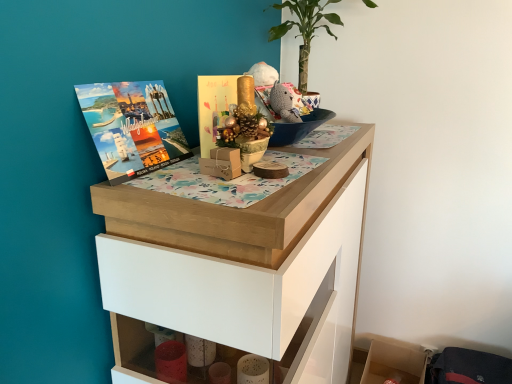
What is the approximate height of wooden shelf at lower right?

It is 10.06 inches.

The image size is (512, 384). Describe the element at coordinates (305, 29) in the screenshot. I see `green leafy plant at upper center` at that location.

What do you see at coordinates (132, 127) in the screenshot? The width and height of the screenshot is (512, 384). I see `matte paper book cover at upper left, which appears as the 1th book cover when viewed from the left` at bounding box center [132, 127].

Locate an element on the screen. This screenshot has width=512, height=384. wooden shelf at lower right is located at coordinates (394, 364).

Would you consider wooden shelf at lower right to be distant from green leafy plant at upper center?

Yes, wooden shelf at lower right is far from green leafy plant at upper center.

Consider the image. Does wooden shelf at lower right have a larger size compared to green leafy plant at upper center?

No, wooden shelf at lower right is not bigger than green leafy plant at upper center.

Between wooden shelf at lower right and green leafy plant at upper center, which one has smaller width?

Thinner between the two is wooden shelf at lower right.

Is point (121, 130) closer to viewer compared to point (211, 134)?

Yes, point (121, 130) is closer to viewer.

Measure the distance from matte paper book cover at upper left, the 2th book cover in the right-to-left sequence, to gold paper card at center, which is counted as the second book cover, starting from the left.

They are 6.07 inches apart.

Between matte paper book cover at upper left, the 2th book cover in the right-to-left sequence, and gold paper card at center, which is counted as the second book cover, starting from the left, which one is positioned behind?

gold paper card at center, which is counted as the second book cover, starting from the left, is further from the camera.

From a real-world perspective, which object rests below the other?

matte paper book cover at upper left, which appears as the 1th book cover when viewed from the left, is physically lower.

Is wooden shelf at lower right looking in the opposite direction of wooden chest of drawers at upper center?

wooden shelf at lower right does not have its back to wooden chest of drawers at upper center.

Consider the image. Between wooden shelf at lower right and wooden chest of drawers at upper center, which one has smaller size?

Smaller between the two is wooden shelf at lower right.

Is point (393, 364) closer to viewer compared to point (349, 159)?

No, it is behind (349, 159).

Is wooden shelf at lower right in front of or behind wooden chest of drawers at upper center in the image?

Visually, wooden shelf at lower right is located behind wooden chest of drawers at upper center.

From a real-world perspective, is wooden chest of drawers at upper center positioned above or below matte paper book cover at upper left, the 2th book cover in the right-to-left sequence?

wooden chest of drawers at upper center is below matte paper book cover at upper left, the 2th book cover in the right-to-left sequence.

Is wooden chest of drawers at upper center oriented away from matte paper book cover at upper left, which appears as the 1th book cover when viewed from the left?

No.

In the image, is wooden chest of drawers at upper center positioned in front of or behind matte paper book cover at upper left, which appears as the 1th book cover when viewed from the left?

In the image, wooden chest of drawers at upper center appears in front of matte paper book cover at upper left, which appears as the 1th book cover when viewed from the left.

Consider the image. Which of these two, wooden chest of drawers at upper center or matte paper book cover at upper left, the 2th book cover in the right-to-left sequence, is bigger?

wooden chest of drawers at upper center is bigger.

At what (x,y) coordinates should I click in order to perform the action: click on the 1st book cover behind the wooden chest of drawers at upper center. Please return your answer as a coordinate pair (x, y). The width and height of the screenshot is (512, 384). Looking at the image, I should click on (132, 127).

Between matte paper book cover at upper left, the 2th book cover in the right-to-left sequence, and wooden chest of drawers at upper center, which one appears on the left side from the viewer's perspective?

Positioned to the left is matte paper book cover at upper left, the 2th book cover in the right-to-left sequence.

How different are the orientations of matte paper book cover at upper left, the 2th book cover in the right-to-left sequence, and wooden chest of drawers at upper center in degrees?

The facing directions of matte paper book cover at upper left, the 2th book cover in the right-to-left sequence, and wooden chest of drawers at upper center are 4.42 degrees apart.

From the image's perspective, is matte paper book cover at upper left, the 2th book cover in the right-to-left sequence, located beneath wooden chest of drawers at upper center?

No, from the image's perspective, matte paper book cover at upper left, the 2th book cover in the right-to-left sequence, is not below wooden chest of drawers at upper center.

In terms of width, does gold paper card at center, which is counted as the second book cover, starting from the left, look wider or thinner when compared to green leafy plant at upper center?

Clearly, gold paper card at center, which is counted as the second book cover, starting from the left, has less width compared to green leafy plant at upper center.

Is gold paper card at center, which is counted as the second book cover, starting from the left, looking in the opposite direction of green leafy plant at upper center?

No, gold paper card at center, which is counted as the second book cover, starting from the left,'s orientation is not away from green leafy plant at upper center.

From the green leafy plant at upper center, count the 1st book cover to the left and point to it. Please provide its 2D coordinates.

[(214, 107)]

Does gold paper card at center, the 1th book cover viewed from the right, have a lesser height compared to green leafy plant at upper center?

Correct, gold paper card at center, the 1th book cover viewed from the right, is not as tall as green leafy plant at upper center.

Which object is positioned more to the left, wooden chest of drawers at upper center or green leafy plant at upper center?

From the viewer's perspective, wooden chest of drawers at upper center appears more on the left side.

Is wooden chest of drawers at upper center oriented away from green leafy plant at upper center?

wooden chest of drawers at upper center does not have its back to green leafy plant at upper center.

In terms of height, does wooden chest of drawers at upper center look taller or shorter compared to green leafy plant at upper center?

Clearly, wooden chest of drawers at upper center is taller compared to green leafy plant at upper center.

Between point (163, 276) and point (295, 15), which one is positioned in front?

Positioned in front is point (163, 276).

This screenshot has height=384, width=512. In order to click on shelf to the right of green leafy plant at upper center in this screenshot , I will do `click(394, 364)`.

In order to click on book cover in front of the gold paper card at center, which is counted as the second book cover, starting from the left in this screenshot , I will do `click(132, 127)`.

From the image, which object appears to be nearer to gold paper card at center, which is counted as the second book cover, starting from the left, wooden shelf at lower right or matte paper book cover at upper left, the 2th book cover in the right-to-left sequence?

matte paper book cover at upper left, the 2th book cover in the right-to-left sequence, is positioned closer to the anchor gold paper card at center, which is counted as the second book cover, starting from the left.

From the image, which object appears to be farther from wooden shelf at lower right, wooden chest of drawers at upper center or matte paper book cover at upper left, which appears as the 1th book cover when viewed from the left?

Among the two, matte paper book cover at upper left, which appears as the 1th book cover when viewed from the left, is located further to wooden shelf at lower right.

Which object lies nearer to the anchor point green leafy plant at upper center, matte paper book cover at upper left, the 2th book cover in the right-to-left sequence, or wooden chest of drawers at upper center?

wooden chest of drawers at upper center.

From the image, which object appears to be nearer to matte paper book cover at upper left, which appears as the 1th book cover when viewed from the left, wooden chest of drawers at upper center or gold paper card at center, which is counted as the second book cover, starting from the left?

gold paper card at center, which is counted as the second book cover, starting from the left, is positioned closer to the anchor matte paper book cover at upper left, which appears as the 1th book cover when viewed from the left.

Considering their positions, is wooden shelf at lower right positioned further to green leafy plant at upper center than wooden chest of drawers at upper center?

wooden shelf at lower right is further to green leafy plant at upper center.

Looking at the image, which one is located closer to matte paper book cover at upper left, the 2th book cover in the right-to-left sequence, gold paper card at center, the 1th book cover viewed from the right, or wooden shelf at lower right?

gold paper card at center, the 1th book cover viewed from the right, is positioned closer to the anchor matte paper book cover at upper left, the 2th book cover in the right-to-left sequence.

Estimate the real-world distances between objects in this image. Which object is closer to green leafy plant at upper center, wooden chest of drawers at upper center or wooden shelf at lower right?

wooden chest of drawers at upper center lies closer to green leafy plant at upper center than the other object.

From the image, which object appears to be farther from wooden chest of drawers at upper center, green leafy plant at upper center or gold paper card at center, which is counted as the second book cover, starting from the left?

The object further to wooden chest of drawers at upper center is green leafy plant at upper center.

Where is `chest of drawers between gold paper card at center, the 1th book cover viewed from the right, and wooden shelf at lower right, in the vertical direction`? The height and width of the screenshot is (384, 512). chest of drawers between gold paper card at center, the 1th book cover viewed from the right, and wooden shelf at lower right, in the vertical direction is located at coordinates (239, 265).

You are a GUI agent. You are given a task and a screenshot of the screen. Output one action in this format:
    pyautogui.click(x=<x>, y=<y>)
    Task: Click on the chest of drawers between green leafy plant at upper center and wooden shelf at lower right in the vertical direction
    
    Given the screenshot: What is the action you would take?
    pyautogui.click(x=239, y=265)

Find the location of `book cover between matte paper book cover at upper left, the 2th book cover in the right-to-left sequence, and green leafy plant at upper center, in the horizontal direction`. book cover between matte paper book cover at upper left, the 2th book cover in the right-to-left sequence, and green leafy plant at upper center, in the horizontal direction is located at coordinates (214, 107).

Locate an element on the screen. This screenshot has width=512, height=384. book cover between gold paper card at center, which is counted as the second book cover, starting from the left, and wooden shelf at lower right, in the vertical direction is located at coordinates (132, 127).